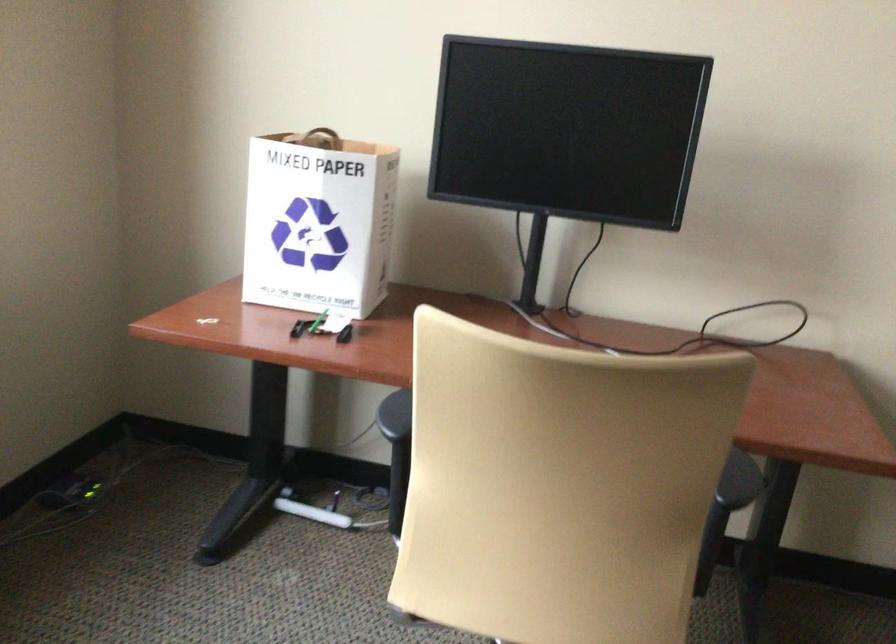
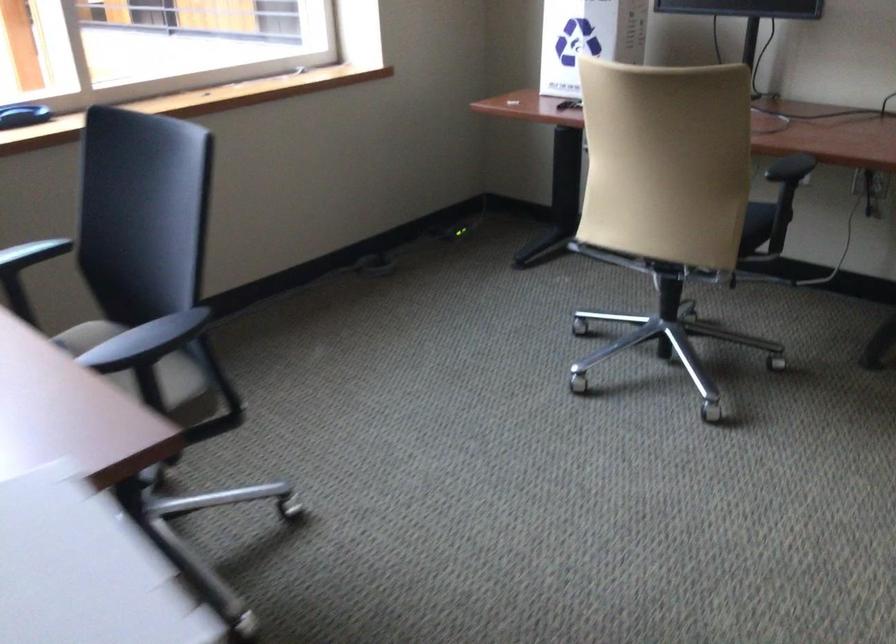
Locate, in the second image, the point that corresponds to pixel 330 236 in the first image.

(588, 39)